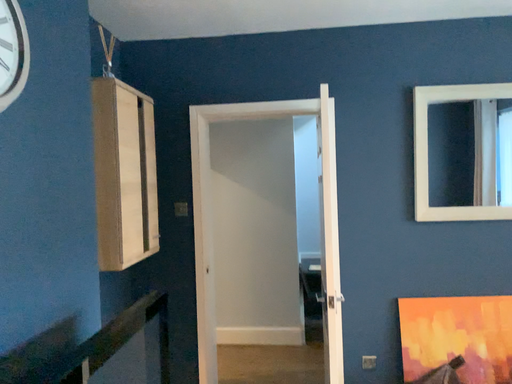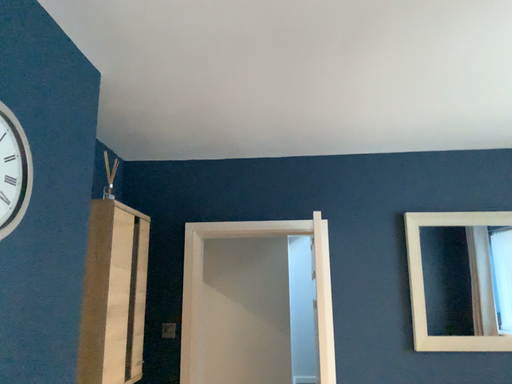
Question: How did the camera likely rotate when shooting the video?

Choices:
 (A) rotated downward
 (B) rotated upward

Answer: (B)